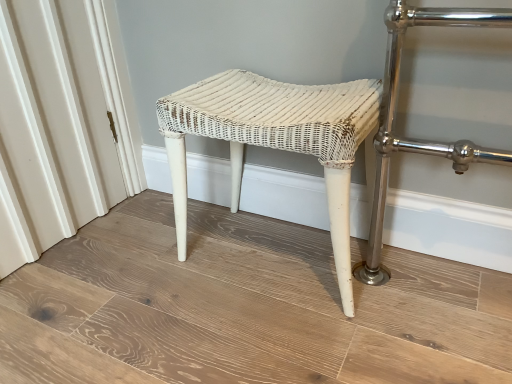
Identify the location of free point below white wicker stool at center (from a real-world perspective). The height and width of the screenshot is (384, 512). (270, 251).